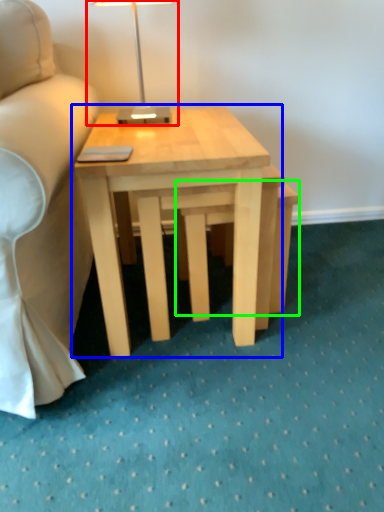
Question: Which object is the farthest from table lamp (highlighted by a red box)? Choose among these: coffee table (highlighted by a blue box) or step stool (highlighted by a green box).

Choices:
 (A) coffee table
 (B) step stool

Answer: (B)